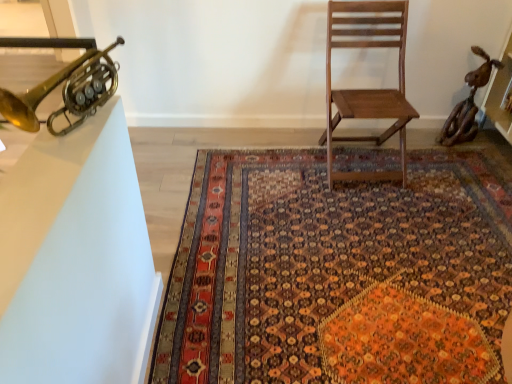
Where is `vacant space underneath gold brass trumpet at upper left (from a real-world perspective)`? This screenshot has height=384, width=512. vacant space underneath gold brass trumpet at upper left (from a real-world perspective) is located at coordinates (79, 125).